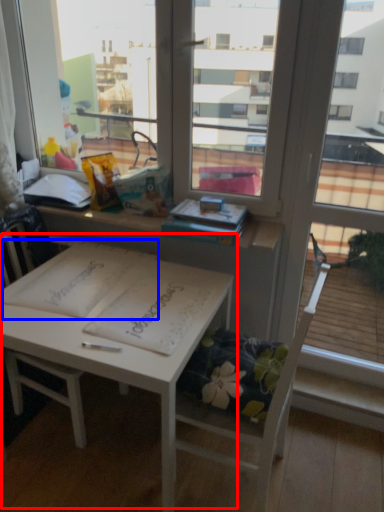
Question: Which object is further to the camera taking this photo, table (highlighted by a red box) or notebook (highlighted by a blue box)?

Choices:
 (A) table
 (B) notebook

Answer: (B)